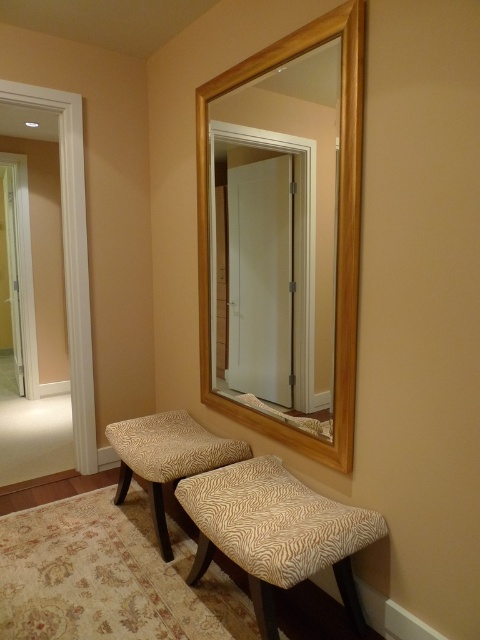
Can you confirm if zebra-patterned fabric stool at lower center is positioned to the left of zebra-patterned fabric stool at center?

Incorrect, zebra-patterned fabric stool at lower center is not on the left side of zebra-patterned fabric stool at center.

Is point (213, 481) closer to viewer compared to point (243, 449)?

Yes, point (213, 481) is closer to viewer.

Measure the distance between point (242, 465) and camera.

Point (242, 465) and camera are 7.00 feet apart from each other.

Where is `zebra-patterned fabric stool at lower center`? The image size is (480, 640). zebra-patterned fabric stool at lower center is located at coordinates (276, 532).

Is wooden mirror at center positioned before zebra-patterned fabric stool at center?

Yes.

Is point (274, 422) positioned before point (140, 461)?

Yes, point (274, 422) is closer to viewer.

Identify the location of wooden mirror at center. (337, 228).

What do you see at coordinates (337, 228) in the screenshot? This screenshot has height=640, width=480. I see `wooden mirror at center` at bounding box center [337, 228].

Which is more to the left, wooden mirror at center or zebra-patterned fabric stool at lower center?

wooden mirror at center

Does point (265, 61) come in front of point (252, 572)?

No, it is not.

Locate an element on the screen. Image resolution: width=480 pixels, height=640 pixels. wooden mirror at center is located at coordinates tap(337, 228).